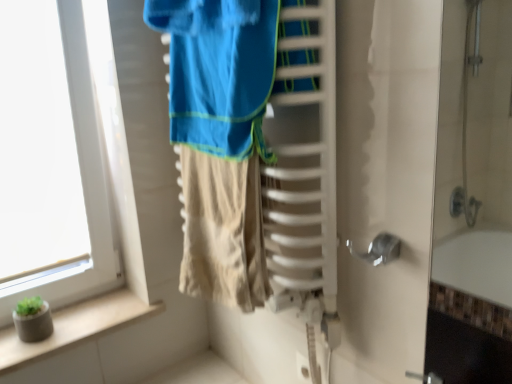
Question: In the image, is white glass window at left positioned in front of or behind white plastic electric outlet at lower center?

Choices:
 (A) front
 (B) behind

Answer: (A)

Question: Considering the positions of white glass window at left and white plastic electric outlet at lower center in the image, is white glass window at left taller or shorter than white plastic electric outlet at lower center?

Choices:
 (A) tall
 (B) short

Answer: (A)

Question: Which object is the closest to the white glass window at left?

Choices:
 (A) green concrete planter at lower left
 (B) white plastic electric outlet at lower center

Answer: (A)

Question: Considering the real-world distances, which object is farthest from the white plastic electric outlet at lower center?

Choices:
 (A) white glass window at left
 (B) green concrete planter at lower left

Answer: (A)